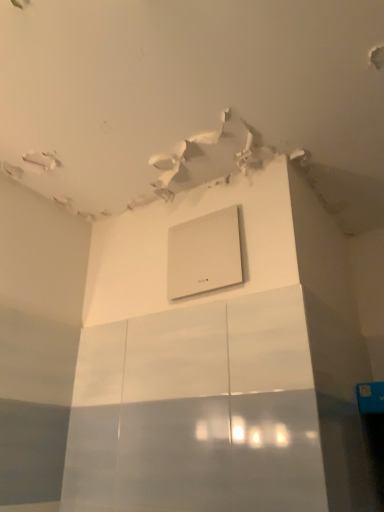
This screenshot has height=512, width=384. What are the coordinates of `white matte air conditioning at center` in the screenshot? It's located at (204, 254).

The width and height of the screenshot is (384, 512). What do you see at coordinates (204, 254) in the screenshot?
I see `white matte air conditioning at center` at bounding box center [204, 254].

The image size is (384, 512). Find the location of `white matte air conditioning at center`. white matte air conditioning at center is located at coordinates (204, 254).